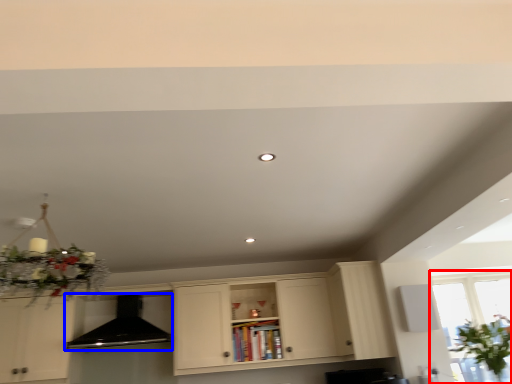
Question: Which of the following is the farthest to the observer, window (highlighted by a red box) or exhaust hood (highlighted by a blue box)?

Choices:
 (A) window
 (B) exhaust hood

Answer: (B)